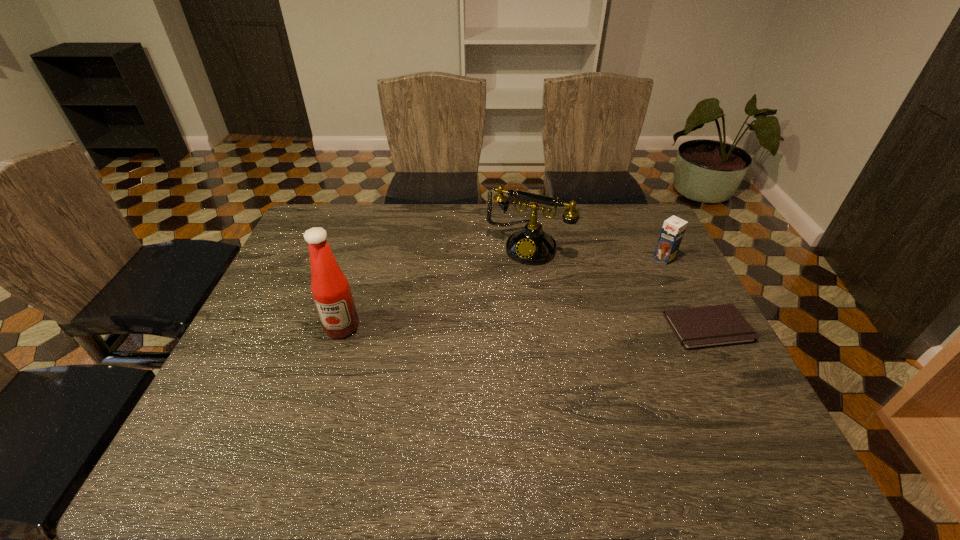
Where is `vacant space on the desktop that is between the condiment and the checkbook and is positioned on the front label of the third tallest object`? vacant space on the desktop that is between the condiment and the checkbook and is positioned on the front label of the third tallest object is located at coordinates (564, 328).

Identify the location of free spot on the desktop that is between the tallest object and the shortest object and is positioned on the dial of the third object from right to left. (x=479, y=328).